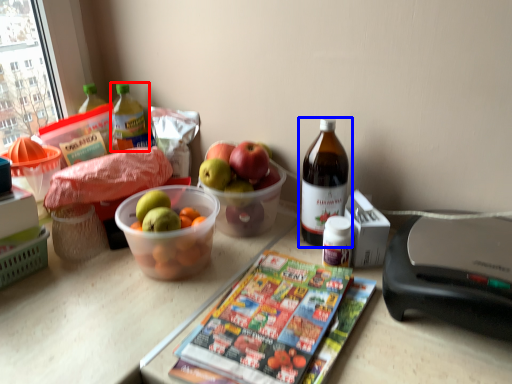
Question: Which point is further to the camera, bottle (highlighted by a red box) or bottle (highlighted by a blue box)?

Choices:
 (A) bottle
 (B) bottle

Answer: (A)